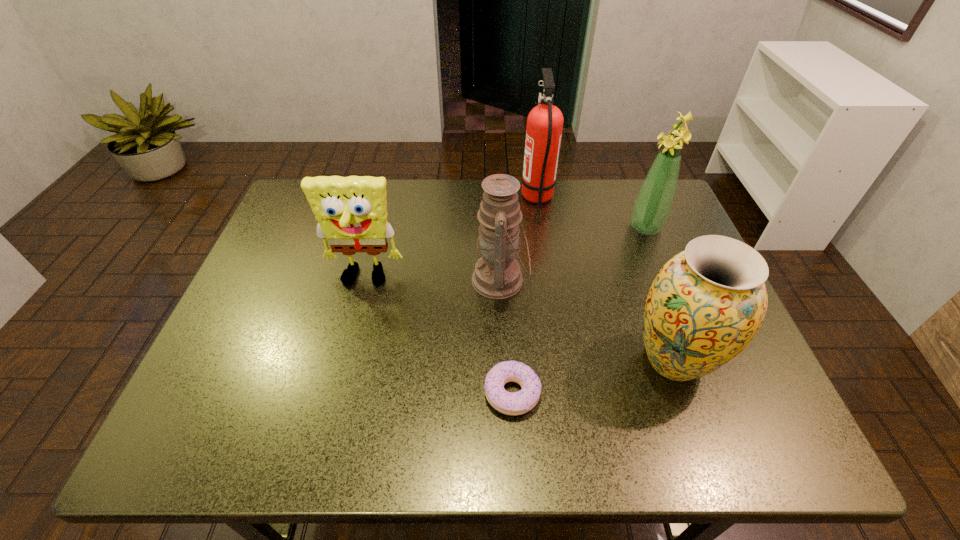
The image size is (960, 540). In order to click on fire extinguisher in this screenshot , I will do `click(545, 121)`.

Locate an element on the screen. the third object from right to left is located at coordinates (545, 121).

In order to click on bouquet in this screenshot , I will do `click(652, 207)`.

The width and height of the screenshot is (960, 540). Identify the location of oil lamp. (497, 275).

Image resolution: width=960 pixels, height=540 pixels. I want to click on vase, so click(x=706, y=304).

Where is `the leftmost object`? the leftmost object is located at coordinates (351, 212).

Identify the location of doughnut. (517, 403).

Identify the location of vacant space positioned on the handle side of the fire extinguisher. The width and height of the screenshot is (960, 540). pyautogui.click(x=415, y=198).

Where is `vacant space located on the handle side of the fire extinguisher`? Image resolution: width=960 pixels, height=540 pixels. vacant space located on the handle side of the fire extinguisher is located at coordinates (486, 198).

Locate an element on the screen. This screenshot has height=540, width=960. blank space located 0.060m on the handle side of the fire extinguisher is located at coordinates tap(501, 198).